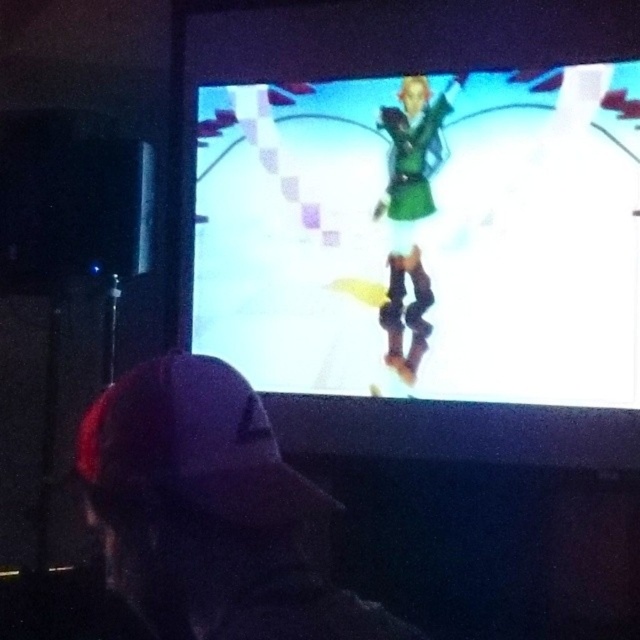
Question: Does dark fabric cap at lower left have a smaller size compared to green matte dress at center?

Choices:
 (A) no
 (B) yes

Answer: (B)

Question: Which object is closer to the camera taking this photo?

Choices:
 (A) green matte dress at center
 (B) dark fabric cap at lower left

Answer: (B)

Question: Is dark fabric cap at lower left to the left of green matte dress at center from the viewer's perspective?

Choices:
 (A) no
 (B) yes

Answer: (B)

Question: Is dark fabric cap at lower left to the right of green matte dress at center from the viewer's perspective?

Choices:
 (A) yes
 (B) no

Answer: (B)

Question: Which point appears closest to the camera in this image?

Choices:
 (A) (404, 269)
 (B) (220, 589)

Answer: (B)